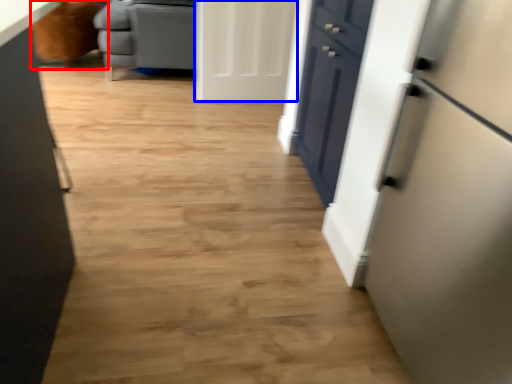
Question: Which point is closer to the camera, armchair (highlighted by a red box) or door (highlighted by a blue box)?

Choices:
 (A) armchair
 (B) door

Answer: (B)